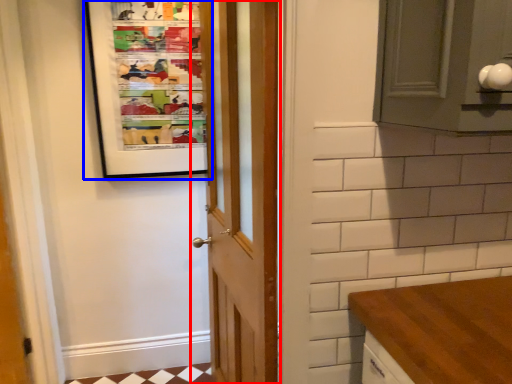
Question: Which object appears closest to the camera in this image, door (highlighted by a red box) or bulletin board (highlighted by a blue box)?

Choices:
 (A) door
 (B) bulletin board

Answer: (A)